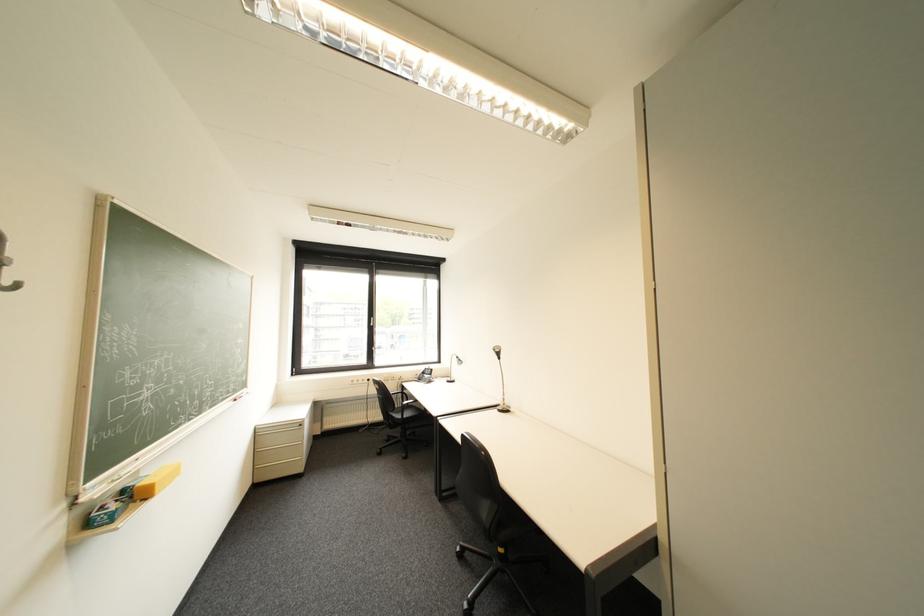
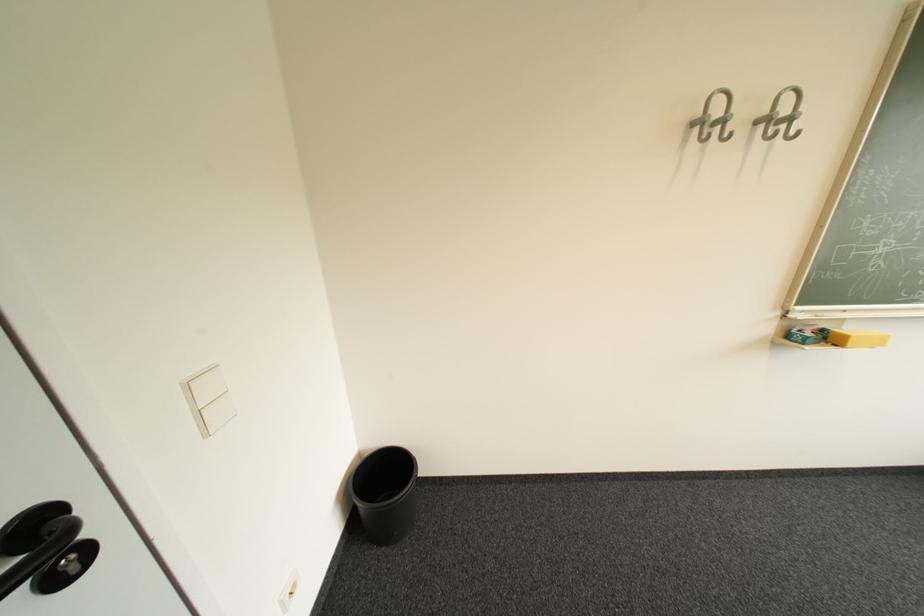
The point at (155, 500) is marked in the first image. Where is the corresponding point in the second image?

(846, 346)